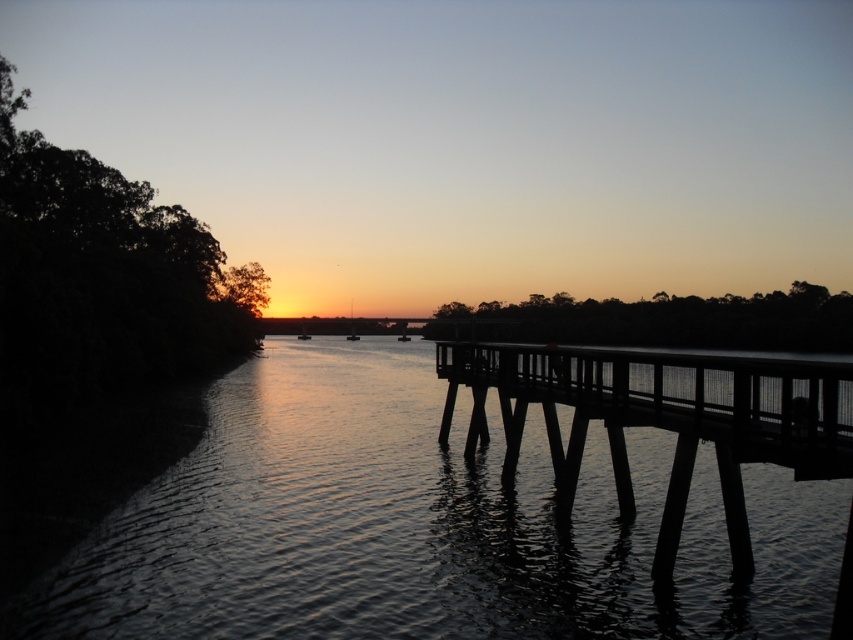
Question: Is dark water at center to the right of black wood dock at right from the viewer's perspective?

Choices:
 (A) no
 (B) yes

Answer: (A)

Question: Does dark water at center have a lesser width compared to black wood dock at right?

Choices:
 (A) yes
 (B) no

Answer: (A)

Question: Is dark water at center wider than black wood dock at right?

Choices:
 (A) yes
 (B) no

Answer: (B)

Question: Which point is farther from the camera taking this photo?

Choices:
 (A) (485, 420)
 (B) (10, 616)

Answer: (A)